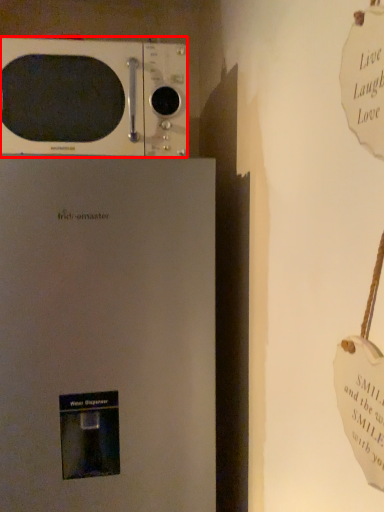
Question: From the image's perspective, where is microwave oven (annotated by the red box) located relative to refrigerator?

Choices:
 (A) below
 (B) above

Answer: (B)